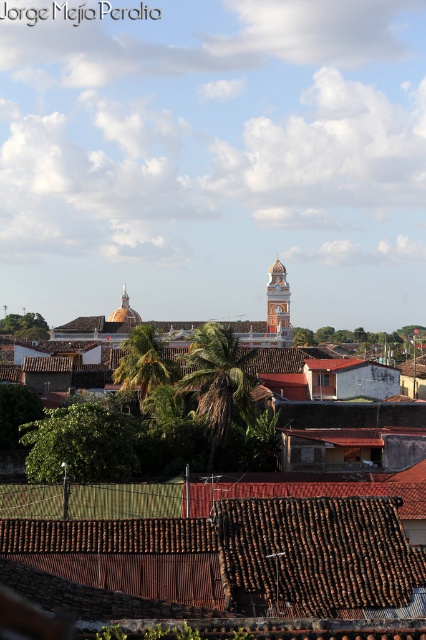
You are standing at the center of the town square and looking towards the orange and white tower in the background. Which direction should you walk to reach the brown corrugated roof at center?

The brown corrugated roof at center is located at point coordinates of (224, 560), so you should walk towards the direction of the orange and white tower in the background to reach it.

You are standing at the point marked as point (238, 556) in the image. What type of roof surface are you currently standing on?

You are standing on a brown corrugated tile roof at lower center.